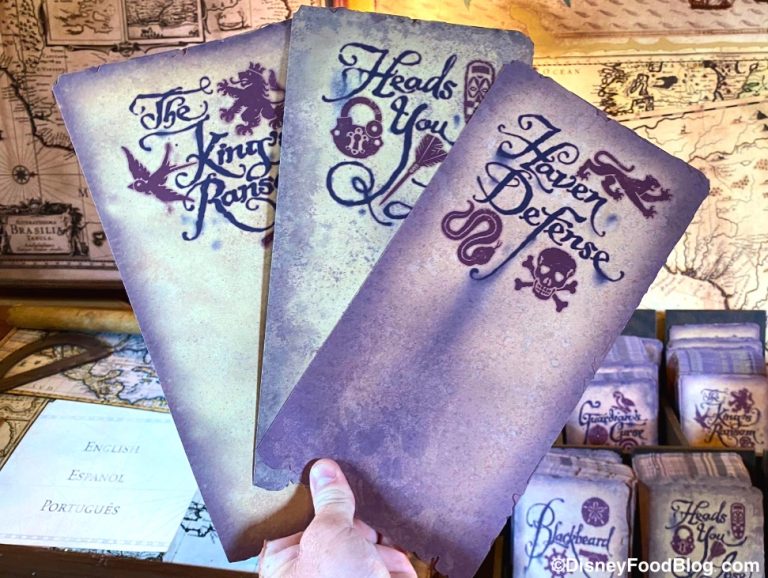
What are the coordinates of `lock` in the screenshot? It's located at (343, 138).